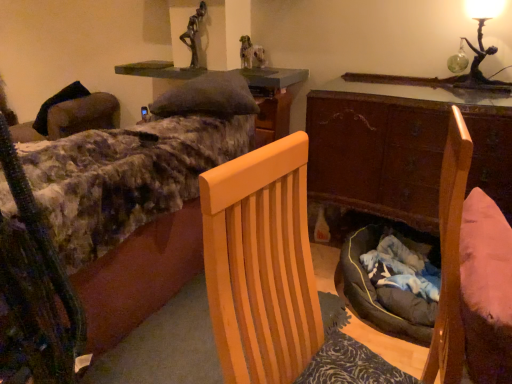
The image size is (512, 384). What do you see at coordinates (138, 165) in the screenshot?
I see `fluffy fabric bed at upper left` at bounding box center [138, 165].

The image size is (512, 384). Describe the element at coordinates (401, 146) in the screenshot. I see `wooden desk at center` at that location.

This screenshot has width=512, height=384. What do you see at coordinates (481, 49) in the screenshot? I see `green glass figure at upper right` at bounding box center [481, 49].

This screenshot has width=512, height=384. Describe the element at coordinates (273, 99) in the screenshot. I see `green felt cushion at upper center` at that location.

Image resolution: width=512 pixels, height=384 pixels. What are the coordinates of `light wood chair at center` in the screenshot? It's located at (261, 264).

From a real-world perspective, is green felt cushion at upper center positioned over fluffy fabric bed at upper left based on gravity?

Indeed, from a real-world perspective, green felt cushion at upper center stands above fluffy fabric bed at upper left.

Who is bigger, green felt cushion at upper center or fluffy fabric bed at upper left?

fluffy fabric bed at upper left is bigger.

Looking at their sizes, would you say green felt cushion at upper center is wider or thinner than fluffy fabric bed at upper left?

green felt cushion at upper center is thinner than fluffy fabric bed at upper left.

Is green felt cushion at upper center not close to fluffy fabric bed at upper left?

green felt cushion at upper center is near fluffy fabric bed at upper left, not far away.

Can you confirm if fluffy fabric bed at upper left is shorter than green felt cushion at upper center?

In fact, fluffy fabric bed at upper left may be taller than green felt cushion at upper center.

Where is `bed on the left of green felt cushion at upper center`? The width and height of the screenshot is (512, 384). bed on the left of green felt cushion at upper center is located at coordinates (138, 165).

Considering the sizes of objects fluffy fabric bed at upper left and green felt cushion at upper center in the image provided, who is thinner, fluffy fabric bed at upper left or green felt cushion at upper center?

With smaller width is green felt cushion at upper center.

From the image's perspective, which is below, fluffy fabric bed at upper left or green felt cushion at upper center?

From the image's view, fluffy fabric bed at upper left is below.

Between green glass figure at upper right and fluffy fabric bed at upper left, which one is positioned in front?

fluffy fabric bed at upper left.

Is green glass figure at upper right facing towards fluffy fabric bed at upper left?

No, green glass figure at upper right is not oriented towards fluffy fabric bed at upper left.

Is point (490, 49) in front of point (155, 136)?

No.

Which of these two, green glass figure at upper right or fluffy fabric bed at upper left, stands shorter?

green glass figure at upper right is shorter.

From the image's perspective, which is above, wooden desk at center or green glass figure at upper right?

green glass figure at upper right is shown above in the image.

Between wooden desk at center and green glass figure at upper right, which one has smaller size?

Smaller between the two is green glass figure at upper right.

Is wooden desk at center facing away from green glass figure at upper right?

wooden desk at center does not have its back to green glass figure at upper right.

Would you say green felt cushion at upper center contains light wood chair at center?

Actually, light wood chair at center is outside green felt cushion at upper center.

Considering the points (147, 65) and (268, 238), which point is in front, point (147, 65) or point (268, 238)?

Point (268, 238)

Is the depth of green felt cushion at upper center less than that of light wood chair at center?

No, green felt cushion at upper center is behind light wood chair at center.

Can you tell me how much green felt cushion at upper center and light wood chair at center differ in facing direction?

The facing directions of green felt cushion at upper center and light wood chair at center are 165 degrees apart.

From the image's perspective, is fluffy fabric bed at upper left under green glass figure at upper right?

Yes, from the image's perspective, fluffy fabric bed at upper left is below green glass figure at upper right.

Can you confirm if fluffy fabric bed at upper left is positioned to the right of green glass figure at upper right?

No, fluffy fabric bed at upper left is not to the right of green glass figure at upper right.

I want to click on table lamp on the right of fluffy fabric bed at upper left, so click(481, 49).

Is green glass figure at upper right surrounded by fluffy fabric bed at upper left?

That's incorrect, green glass figure at upper right is not inside fluffy fabric bed at upper left.

How different are the orientations of wooden desk at center and green felt cushion at upper center in degrees?

There is a 111-degree angle between the facing directions of wooden desk at center and green felt cushion at upper center.

Does wooden desk at center turn towards green felt cushion at upper center?

No, wooden desk at center does not turn towards green felt cushion at upper center.

Looking at their sizes, would you say wooden desk at center is wider or thinner than green felt cushion at upper center?

Clearly, wooden desk at center has more width compared to green felt cushion at upper center.

This screenshot has height=384, width=512. Identify the location of bed in front of the green felt cushion at upper center. (138, 165).

Where is `bed that appears below the green felt cushion at upper center (from a real-world perspective)`? This screenshot has width=512, height=384. bed that appears below the green felt cushion at upper center (from a real-world perspective) is located at coordinates (138, 165).

Considering their positions, is green glass figure at upper right positioned further to light wood chair at center than fluffy fabric bed at upper left?

The object further to light wood chair at center is green glass figure at upper right.

Based on the photo, considering their positions, is wooden desk at center positioned further to green felt cushion at upper center than light wood chair at center?

Among the two, light wood chair at center is located further to green felt cushion at upper center.

Considering their positions, is green felt cushion at upper center positioned further to fluffy fabric bed at upper left than green glass figure at upper right?

The object further to fluffy fabric bed at upper left is green glass figure at upper right.

Looking at the image, which one is located further to green felt cushion at upper center, wooden desk at center or fluffy fabric bed at upper left?

fluffy fabric bed at upper left is further to green felt cushion at upper center.

Looking at the image, which one is located further to green felt cushion at upper center, fluffy fabric bed at upper left or green glass figure at upper right?

Among the two, green glass figure at upper right is located further to green felt cushion at upper center.

Based on their spatial positions, is green felt cushion at upper center or wooden desk at center further from fluffy fabric bed at upper left?

Based on the image, wooden desk at center appears to be further to fluffy fabric bed at upper left.

When comparing their distances from wooden desk at center, does green felt cushion at upper center or light wood chair at center seem further?

light wood chair at center lies further to wooden desk at center than the other object.

From the image, which object appears to be nearer to wooden desk at center, fluffy fabric bed at upper left or green felt cushion at upper center?

green felt cushion at upper center is closer to wooden desk at center.

You are a GUI agent. You are given a task and a screenshot of the screen. Output one action in this format:
    pyautogui.click(x=<x>, y=<y>)
    Task: Click on the desk between green felt cushion at upper center and green glass figure at upper right
    
    Given the screenshot: What is the action you would take?
    pyautogui.click(x=401, y=146)

Where is `desk between light wood chair at center and green glass figure at upper right from front to back`? desk between light wood chair at center and green glass figure at upper right from front to back is located at coordinates (401, 146).

In order to click on desk between fluffy fabric bed at upper left and green glass figure at upper right in this screenshot , I will do `click(401, 146)`.

The height and width of the screenshot is (384, 512). What are the coordinates of `chair between fluffy fabric bed at upper left and green glass figure at upper right` in the screenshot? It's located at (261, 264).